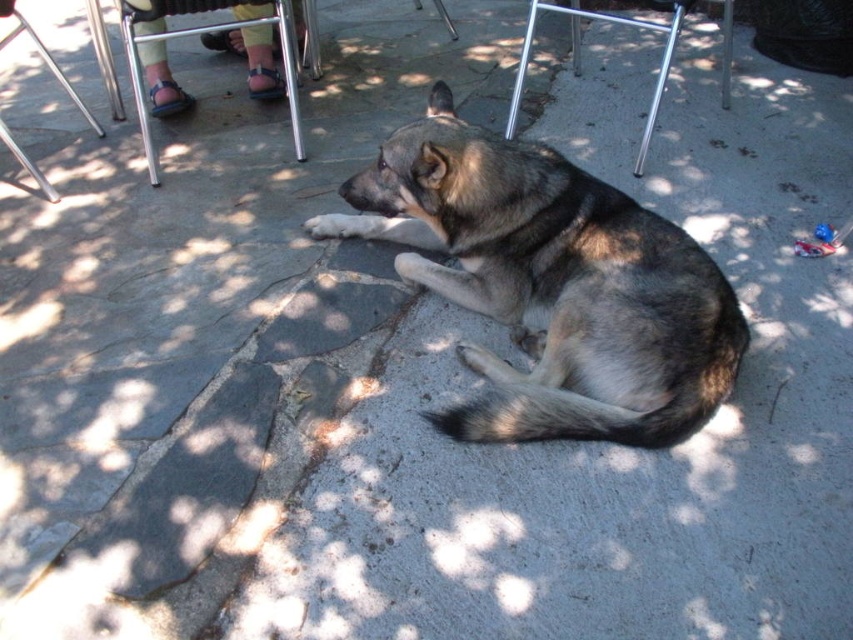
Between metallic silver chair at upper left and metallic silver chair at upper center, which one is positioned higher?

metallic silver chair at upper center

Is point (287, 44) positioned behind point (572, 67)?

No, it is not.

I want to click on metallic silver chair at upper left, so click(x=196, y=33).

This screenshot has height=640, width=853. Find the location of `metallic silver chair at upper left`. metallic silver chair at upper left is located at coordinates (196, 33).

Can you confirm if gray fur dog at center is positioned below metallic silver chair at upper left?

Indeed, gray fur dog at center is positioned under metallic silver chair at upper left.

Consider the image. Can you confirm if gray fur dog at center is bigger than metallic silver chair at upper left?

Indeed, gray fur dog at center has a larger size compared to metallic silver chair at upper left.

Where is `gray fur dog at center`? This screenshot has height=640, width=853. gray fur dog at center is located at coordinates (550, 285).

Image resolution: width=853 pixels, height=640 pixels. I want to click on gray fur dog at center, so click(550, 285).

Can you confirm if gray fur dog at center is taller than brushed metal chair at upper left?

Yes, gray fur dog at center is taller than brushed metal chair at upper left.

Is gray fur dog at center positioned before brushed metal chair at upper left?

Yes, gray fur dog at center is in front of brushed metal chair at upper left.

This screenshot has height=640, width=853. Describe the element at coordinates (550, 285) in the screenshot. I see `gray fur dog at center` at that location.

Image resolution: width=853 pixels, height=640 pixels. I want to click on gray fur dog at center, so click(x=550, y=285).